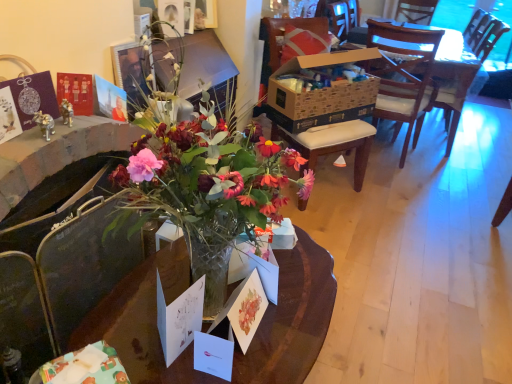
Question: From a real-world perspective, is white paper postcard at center, which is the 1th postcard from left to right, positioned under matte paper postcard at center, the third postcard when ordered from left to right, based on gravity?

Choices:
 (A) yes
 (B) no

Answer: (B)

Question: Would you say white paper postcard at center, marked as the 3th postcard in a right-to-left arrangement, is outside matte paper postcard at center, which appears as the 1th postcard when viewed from the right?

Choices:
 (A) yes
 (B) no

Answer: (A)

Question: Could you tell me if white paper postcard at center, which is the 1th postcard from left to right, is turned towards matte paper postcard at center, the third postcard when ordered from left to right?

Choices:
 (A) no
 (B) yes

Answer: (A)

Question: Does white paper postcard at center, marked as the 3th postcard in a right-to-left arrangement, appear on the right side of matte paper postcard at center, the third postcard when ordered from left to right?

Choices:
 (A) yes
 (B) no

Answer: (B)

Question: Is white paper postcard at center, which is the 1th postcard from left to right, smaller than matte paper postcard at center, which appears as the 1th postcard when viewed from the right?

Choices:
 (A) yes
 (B) no

Answer: (B)

Question: Looking at their shapes, would you say matte paper postcard at center, which appears as the 1th postcard when viewed from the right, is wider or thinner than translucent glass vase at center?

Choices:
 (A) thin
 (B) wide

Answer: (A)

Question: Would you say matte paper postcard at center, which appears as the 1th postcard when viewed from the right, is to the left or to the right of translucent glass vase at center in the picture?

Choices:
 (A) left
 (B) right

Answer: (B)

Question: Is matte paper postcard at center, the third postcard when ordered from left to right, inside or outside of translucent glass vase at center?

Choices:
 (A) inside
 (B) outside

Answer: (B)

Question: Is point (252, 286) closer or farther from the camera than point (162, 367)?

Choices:
 (A) closer
 (B) farther

Answer: (B)

Question: From a real-world perspective, is matte paper postcard at center, the third postcard when ordered from left to right, positioned above or below brown cardboard box at center, placed as the 2th box when sorted from left to right?

Choices:
 (A) below
 (B) above

Answer: (A)

Question: Considering the positions of point (237, 306) and point (292, 57), is point (237, 306) closer or farther from the camera than point (292, 57)?

Choices:
 (A) farther
 (B) closer

Answer: (B)

Question: In terms of size, does matte paper postcard at center, which appears as the 1th postcard when viewed from the right, appear bigger or smaller than brown cardboard box at center, arranged as the second box when viewed from the front?

Choices:
 (A) big
 (B) small

Answer: (B)

Question: Is matte paper postcard at center, which appears as the 1th postcard when viewed from the right, wider or thinner than brown cardboard box at center, the 1th box positioned from the right?

Choices:
 (A) thin
 (B) wide

Answer: (A)

Question: In terms of height, does brown cardboard box at center, which is the 1th box in back-to-front order, look taller or shorter compared to white paper postcard at center, the 2th postcard in the right-to-left sequence?

Choices:
 (A) tall
 (B) short

Answer: (A)

Question: Considering the positions of point (291, 92) and point (201, 365), is point (291, 92) closer or farther from the camera than point (201, 365)?

Choices:
 (A) closer
 (B) farther

Answer: (B)